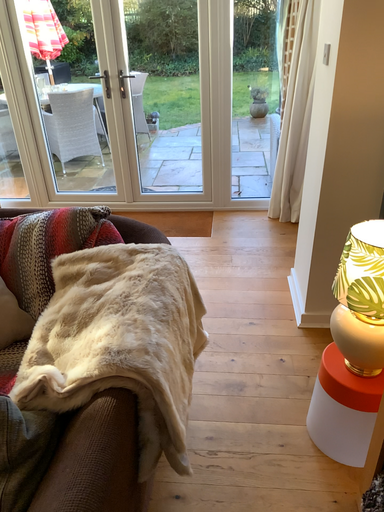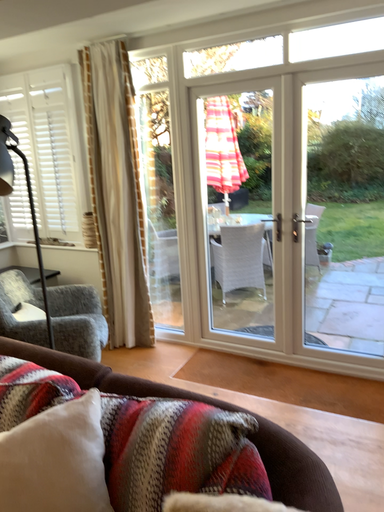
Question: Which way did the camera rotate in the video?

Choices:
 (A) rotated left
 (B) rotated right

Answer: (A)